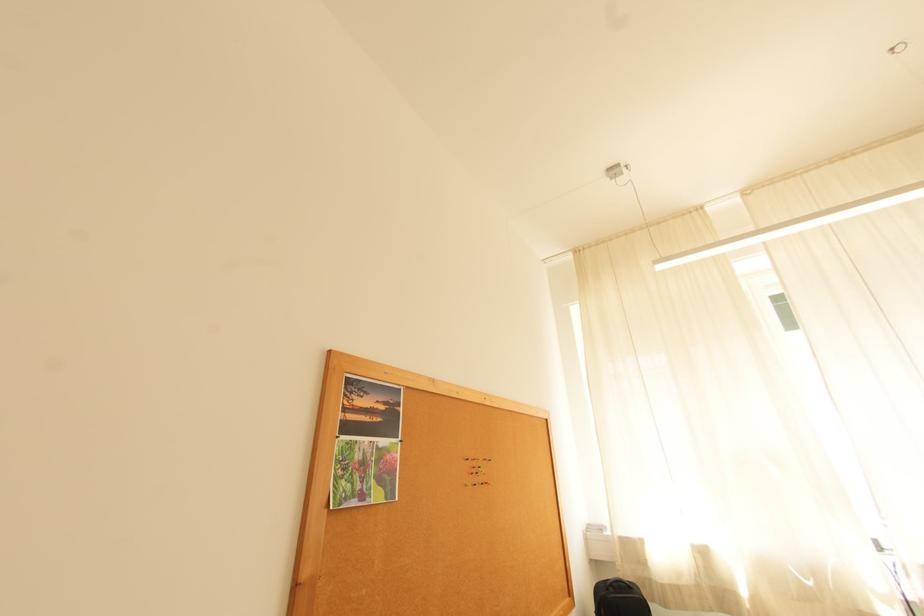
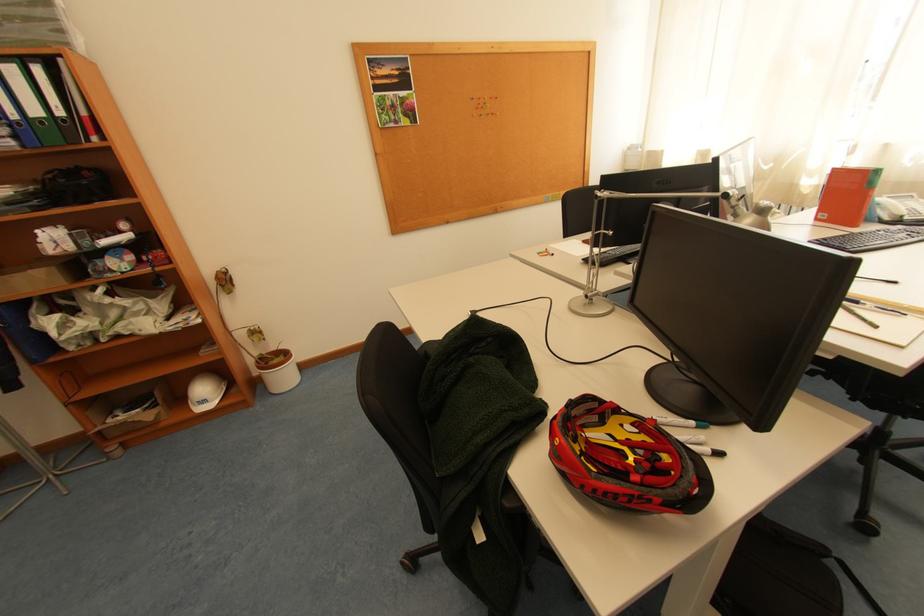
Locate, in the second image, the point that corresponds to (476,461) in the first image.

(480, 100)